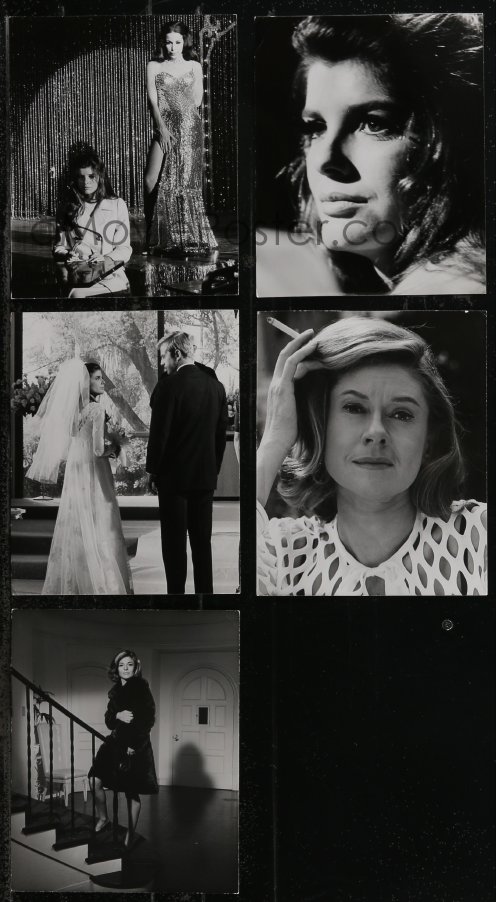
Where is `staircase`? staircase is located at coordinates (65, 815).